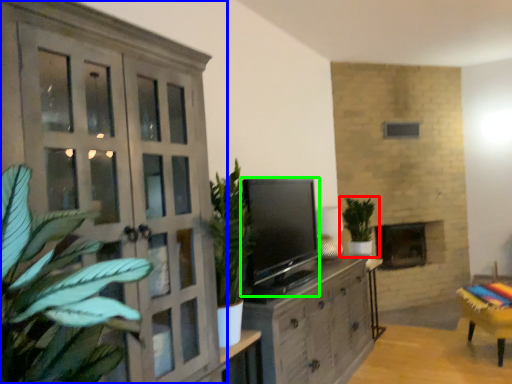
Question: Which object is the closest to the houseplant (highlighted by a red box)? Choose among these: cupboard (highlighted by a blue box) or level (highlighted by a green box).

Choices:
 (A) cupboard
 (B) level

Answer: (B)